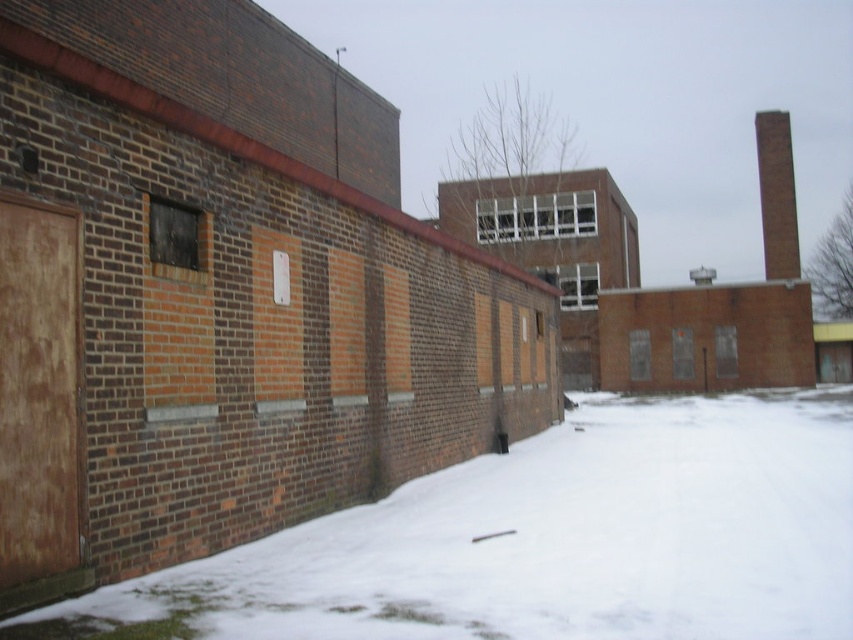
Question: Can you confirm if white powdery snow at lower left is positioned above brick chimney at upper right?

Choices:
 (A) no
 (B) yes

Answer: (A)

Question: Can you confirm if white powdery snow at lower left is positioned below brick chimney at upper right?

Choices:
 (A) yes
 (B) no

Answer: (A)

Question: Does white powdery snow at lower left lie in front of brick chimney at upper right?

Choices:
 (A) no
 (B) yes

Answer: (B)